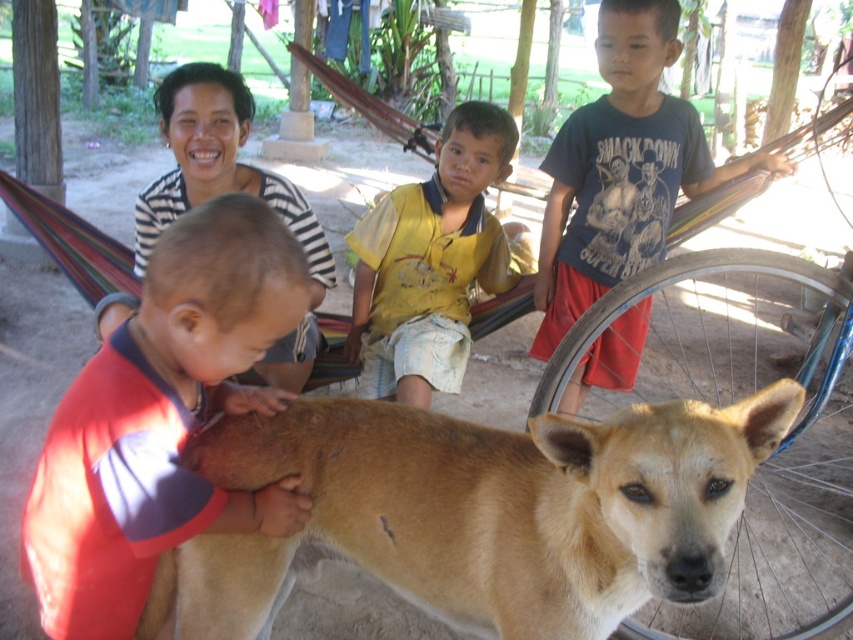
Question: Is brown furry dog at center below matte brown dog at center?

Choices:
 (A) no
 (B) yes

Answer: (B)

Question: Is brown furry dog at center below matte brown dog at center?

Choices:
 (A) no
 (B) yes

Answer: (B)

Question: Which object appears closest to the camera in this image?

Choices:
 (A) matte brown dog at center
 (B) yellow cotton shirt at center

Answer: (A)

Question: Among these points, which one is farthest from the camera?

Choices:
 (A) (456, 602)
 (B) (476, 196)
 (C) (573, 320)

Answer: (B)

Question: Which object is farther from the camera taking this photo?

Choices:
 (A) matte brown dog at center
 (B) red cotton shirt at left

Answer: (A)

Question: Does brown furry dog at center have a larger size compared to dark blue t-shirt at upper right?

Choices:
 (A) no
 (B) yes

Answer: (A)